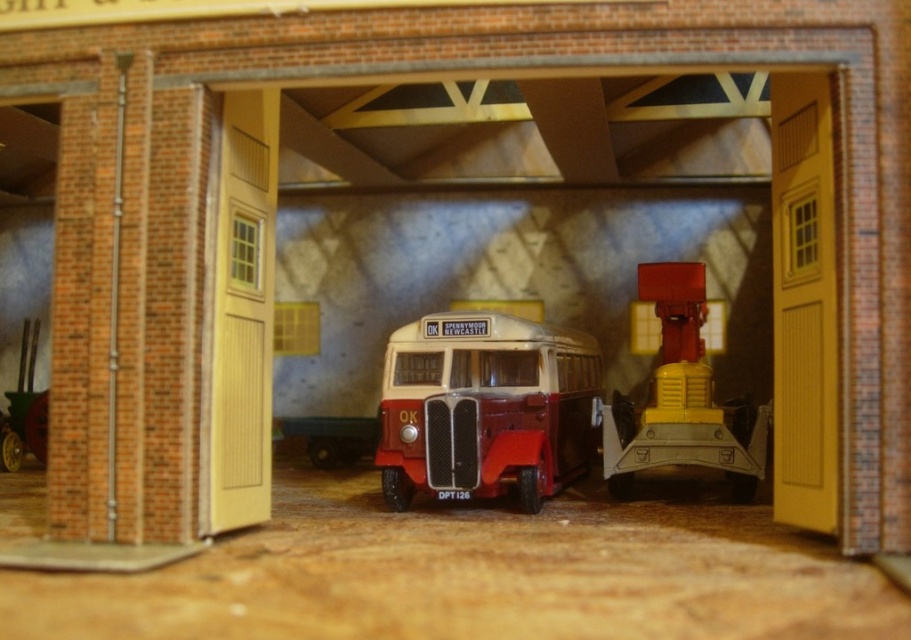
You are a model train enthusiast who wants to place a new train set inside the garage. The train set requires a clear path above the existing objects. Can you place it above the matte red bus at center and the metallic yellow and red crane at center without any obstruction?

The matte red bus at center is below the metallic yellow and red crane at center, so placing the train set above both would require ensuring it is positioned above the crane, as the bus is already under it. However, there might still be space above the crane if it doesn

You are a small toy car trying to navigate through the garage. There are two points marked in the garage, one at point (572, 433) and another at point (643, 292). If you start from the entrance of the garage, which point should you head towards first to reach the back of the garage?

Point (643, 292) should be headed towards first because it is in front of point (572, 433), which is behind it. Since you start from the entrance, moving towards the closer point first would lead you towards the back of the garage.